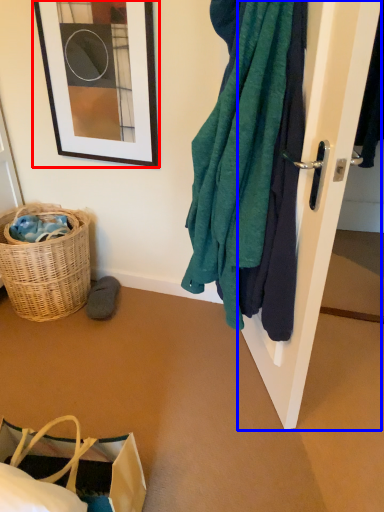
Question: Which point is closer to the camera, picture frame (highlighted by a red box) or door (highlighted by a blue box)?

Choices:
 (A) picture frame
 (B) door

Answer: (B)